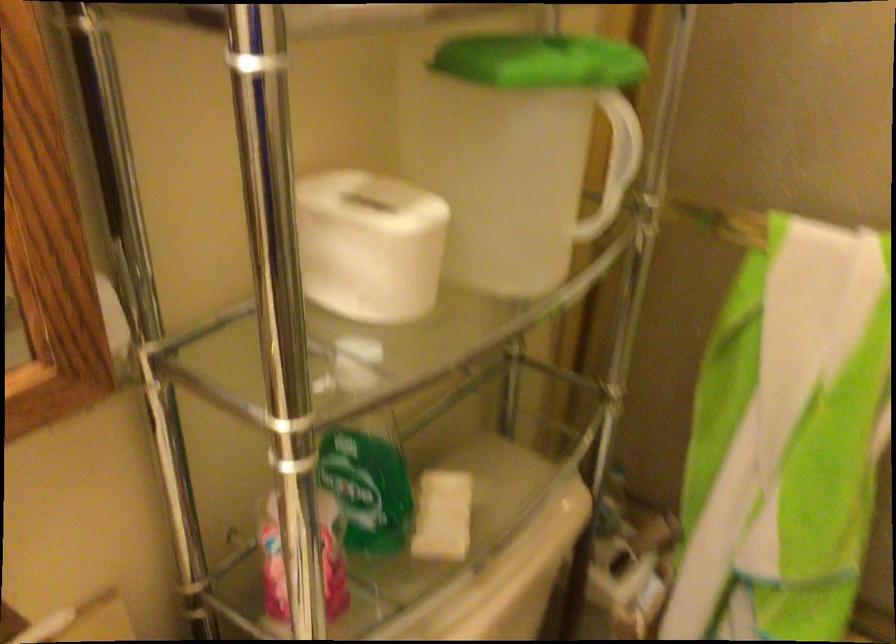
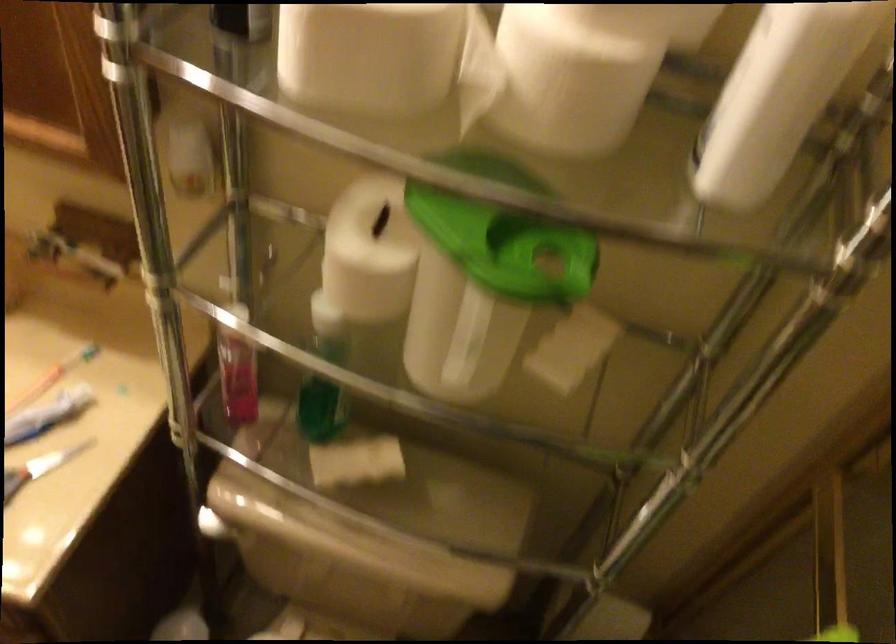
Locate, in the second image, the point that corresponds to pixel 418 221 in the first image.

(369, 252)